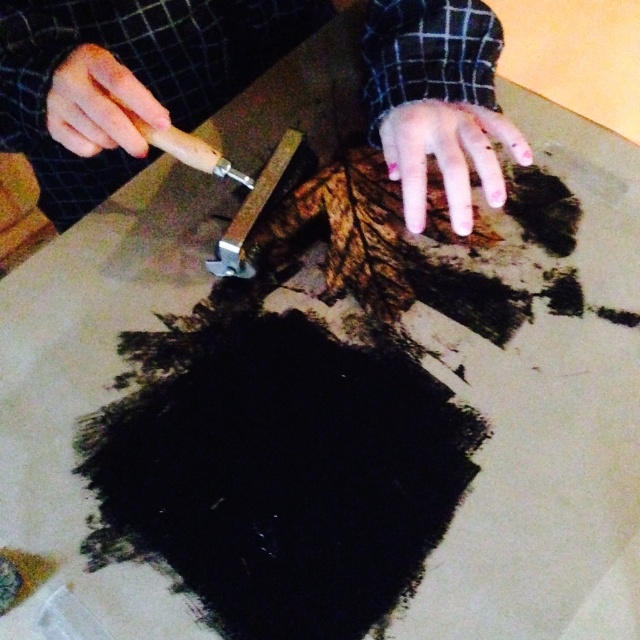
Between wooden-handled tool at upper center and wooden handle knife at center, which one appears on the left side from the viewer's perspective?

wooden-handled tool at upper center

The height and width of the screenshot is (640, 640). Identify the location of wooden-handled tool at upper center. (125, 77).

You are a GUI agent. You are given a task and a screenshot of the screen. Output one action in this format:
    pyautogui.click(x=<x>, y=<y>)
    Task: Click on the wooden-handled tool at upper center
    This screenshot has height=640, width=640.
    Given the screenshot: What is the action you would take?
    pyautogui.click(x=125, y=77)

Which is above, wooden-handled tool at upper center or pale skin at center?

wooden-handled tool at upper center

Measure the distance between wooden-handled tool at upper center and pale skin at center.

A distance of 6.48 inches exists between wooden-handled tool at upper center and pale skin at center.

Is point (56, 20) closer to viewer compared to point (474, 140)?

No, it is behind (474, 140).

Locate an element on the screen. Image resolution: width=640 pixels, height=640 pixels. wooden-handled tool at upper center is located at coordinates (125, 77).

Is pale skin at center shorter than wooden handle knife at center?

Yes.

In order to click on pale skin at center in this screenshot , I will do `click(448, 156)`.